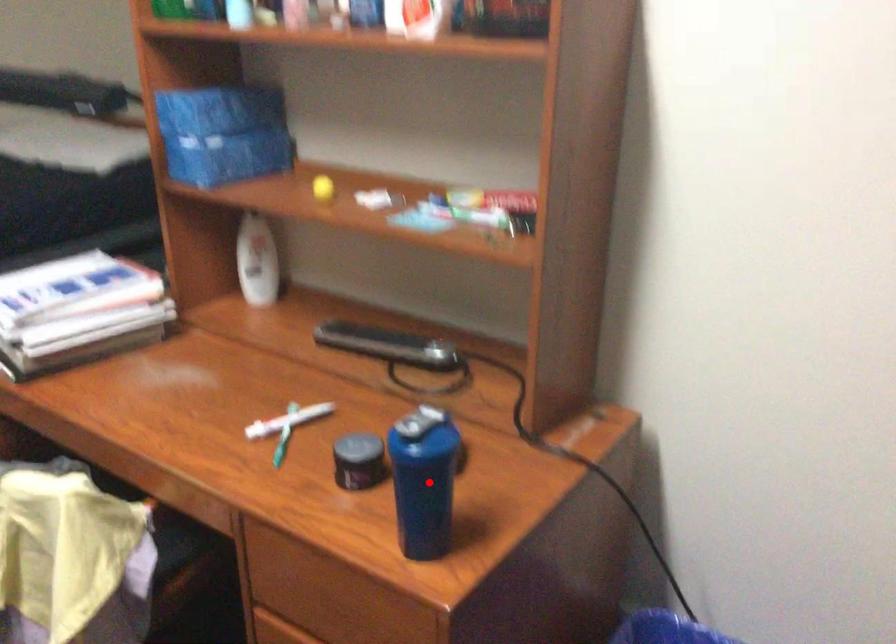
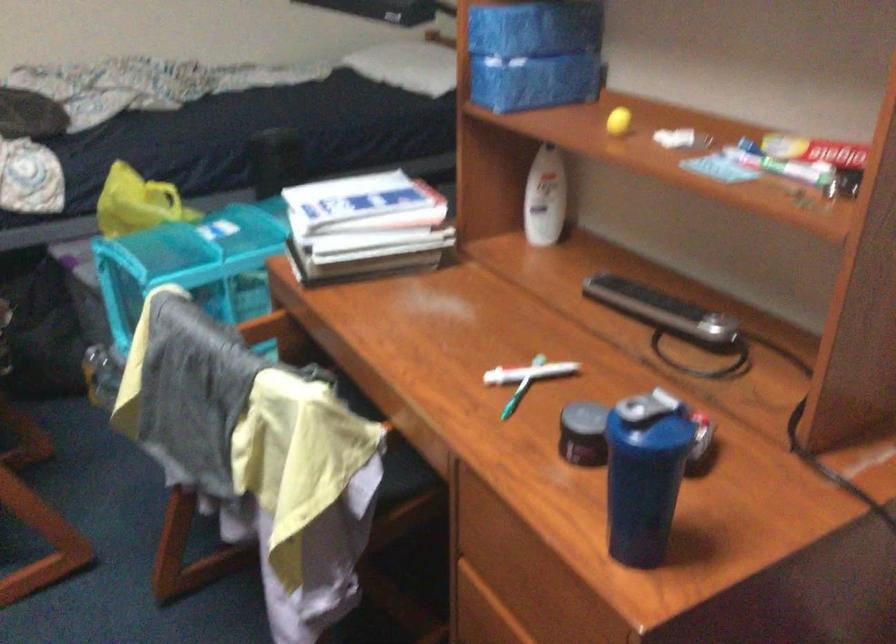
Question: I am providing you with two images of the same scene from different viewpoints. Given a red point in image1, look at the same physical point in image2. Is it:

Choices:
 (A) Closer to the viewpoint
 (B) Farther from the viewpoint

Answer: (A)